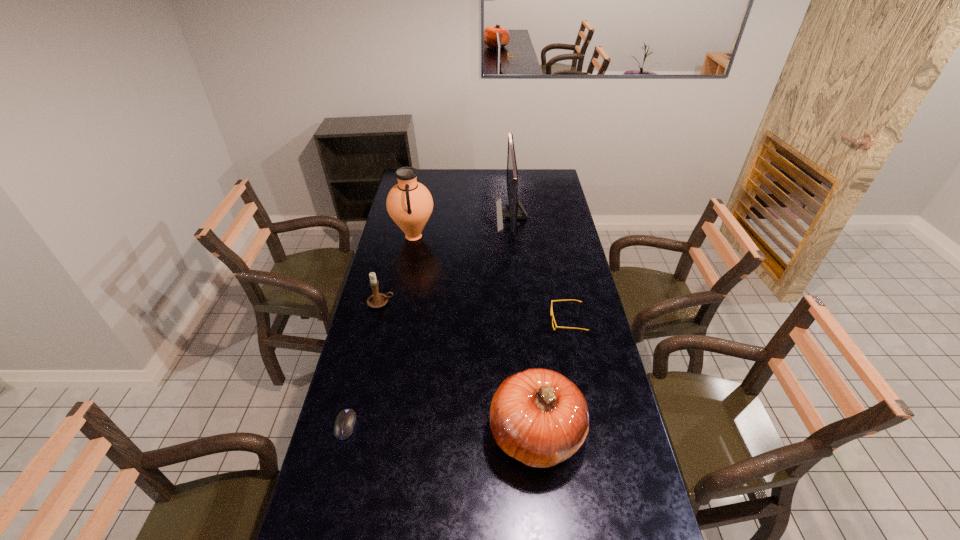
Find the location of `blank space located 0.100m on the left of the third tallest object`. blank space located 0.100m on the left of the third tallest object is located at coordinates (456, 435).

Find the location of a particular element. vacant space situated on the side of the third shortest object with the handle is located at coordinates (x=445, y=302).

Image resolution: width=960 pixels, height=540 pixels. What are the coordinates of `vacant region located in front of the lenses of the fifth tallest object` in the screenshot? It's located at (476, 321).

Locate an element on the screen. blank space located in front of the lenses of the fifth tallest object is located at coordinates (528, 321).

This screenshot has height=540, width=960. Identify the location of vacant position located in front of the lenses of the fifth tallest object. (468, 321).

Where is `free space located 0.090m on the right of the computer mouse`? This screenshot has height=540, width=960. free space located 0.090m on the right of the computer mouse is located at coordinates (x=385, y=426).

Find the location of a particular element. The image size is (960, 540). pitcher positioned at the left edge is located at coordinates (409, 203).

At what (x,y) coordinates should I click in order to perform the action: click on candle holder situated at the left edge. Please return your answer as a coordinate pair (x, y). Looking at the image, I should click on (377, 300).

The height and width of the screenshot is (540, 960). What are the coordinates of `computer mouse that is at the left edge` in the screenshot? It's located at (345, 421).

At what (x,y) coordinates should I click in order to perform the action: click on pumpkin that is at the right edge. Please return your answer as a coordinate pair (x, y). The image size is (960, 540). Looking at the image, I should click on (539, 417).